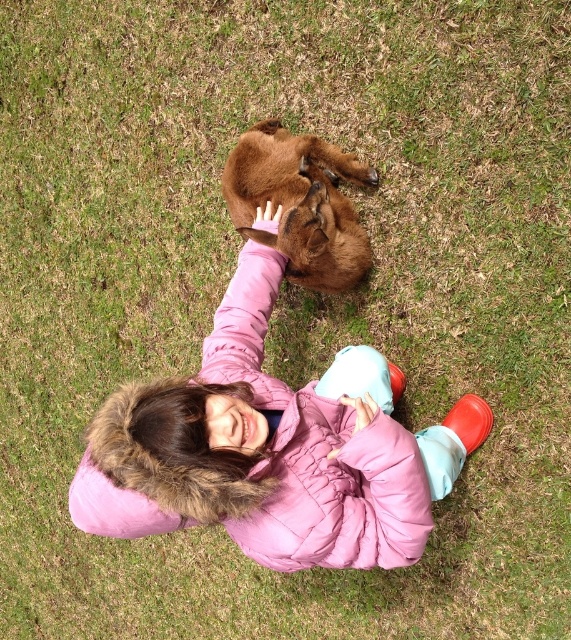
You are a photographer trying to capture a closeup of the pink quilted jacket at center and the brown furry dog at center. Since both are at the center, which one will appear closer to the camera in the photo?

The pink quilted jacket at center appears closer to the camera because it is positioned in front of the brown furry dog at center.

You are a photographer trying to capture a closeup shot of both the pink quilted jacket at center and the brown furry dog at center in the scene. Your camera can focus on objects within a 60 cm range. Can you fit both subjects into the frame without moving the camera?

The pink quilted jacket at center and the brown furry dog at center are 50.88 centimeters apart. Since the distance between them is less than 60 cm, you can fit both subjects into the frame without moving the camera.